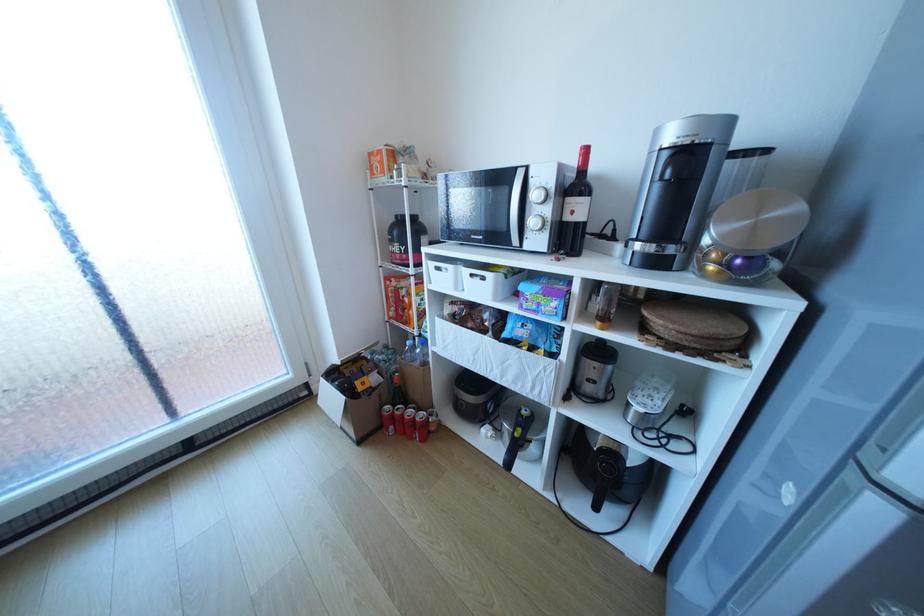
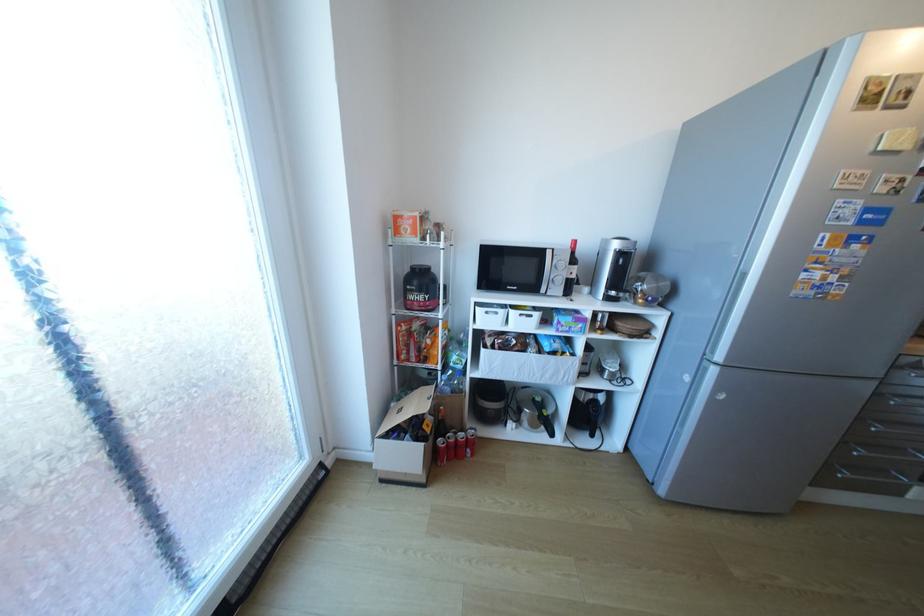
Where in the second image is the point corresponding to pixel 432 368 from the first image?

(472, 394)